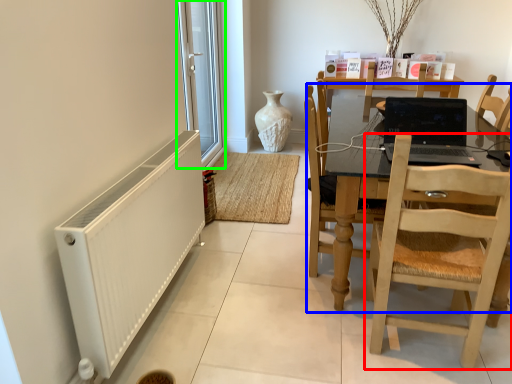
Question: Which is nearer to the chair (highlighted by a red box)? kitchen & dining room table (highlighted by a blue box) or window screen (highlighted by a green box).

Choices:
 (A) kitchen & dining room table
 (B) window screen

Answer: (A)